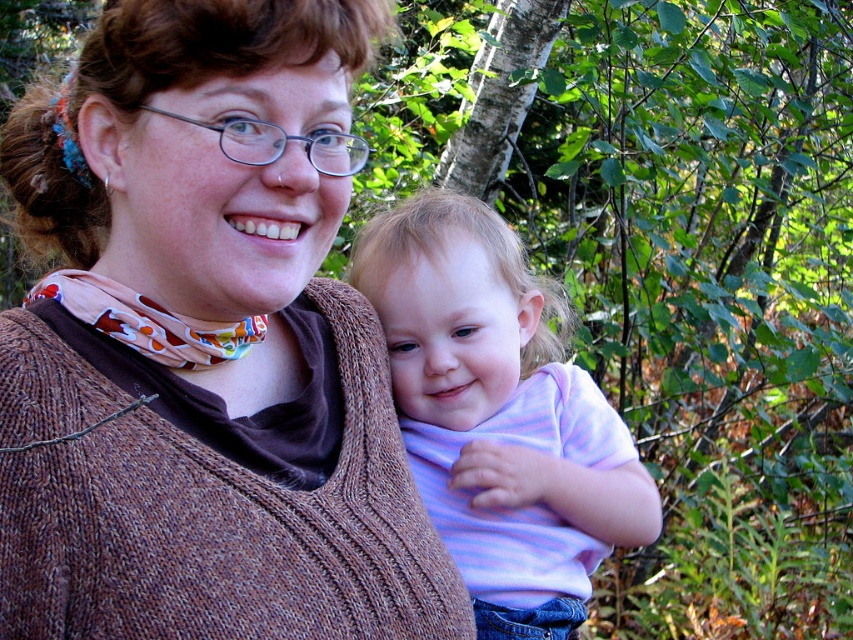
You are a photographer trying to capture a closeup of both the brown knitted sweater at center and the pastel striped shirt at center in the image. Can you fit both into your camera frame if your camera has a maximum width of 10 inches?

The brown knitted sweater at center and pastel striped shirt at center are 11.12 inches apart from each other. Since the distance between them exceeds the camera frame width of 10 inches, you cannot fit both into the frame at the same time.

You are a fashion designer analyzing this image. You need to determine which clothing item is taller between the brown knitted sweater at center and the pastel striped shirt at center. Which one is taller?

The brown knitted sweater at center is taller than the pastel striped shirt at center according to the description.